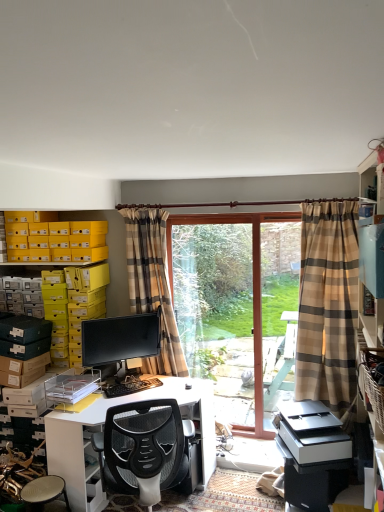
Question: Should I look upward or downward to see plaid fabric curtain at center, acting as the 1th curtain starting from the back?

Choices:
 (A) down
 (B) up

Answer: (A)

Question: Is yellow cardboard box at upper left at the left side of plaid fabric curtain at center, which is counted as the second curtain, starting from the right?

Choices:
 (A) no
 (B) yes

Answer: (B)

Question: Considering the relative sizes of yellow cardboard box at upper left and plaid fabric curtain at center, which is counted as the second curtain, starting from the right, in the image provided, is yellow cardboard box at upper left shorter than plaid fabric curtain at center, which is counted as the second curtain, starting from the right,?

Choices:
 (A) no
 (B) yes

Answer: (B)

Question: Could plaid fabric curtain at center, which is counted as the second curtain, starting from the right, be considered to be inside yellow cardboard box at upper left?

Choices:
 (A) yes
 (B) no

Answer: (B)

Question: Is yellow cardboard box at upper left taller than plaid fabric curtain at center, acting as the 1th curtain starting from the back?

Choices:
 (A) no
 (B) yes

Answer: (A)

Question: Is yellow cardboard box at upper left far from plaid fabric curtain at center, which is counted as the second curtain, starting from the right?

Choices:
 (A) no
 (B) yes

Answer: (A)

Question: Are yellow cardboard box at upper left and plaid fabric curtain at center, which ranks as the 2th curtain in front-to-back order, making contact?

Choices:
 (A) no
 (B) yes

Answer: (A)

Question: Considering the relative sizes of plaid fabric curtain at center, which is the first curtain in left-to-right order, and plaid fabric curtain at right, the 2th curtain when ordered from back to front, in the image provided, is plaid fabric curtain at center, which is the first curtain in left-to-right order, taller than plaid fabric curtain at right, the 2th curtain when ordered from back to front,?

Choices:
 (A) yes
 (B) no

Answer: (B)

Question: Are plaid fabric curtain at center, acting as the 1th curtain starting from the back, and plaid fabric curtain at right, the 2th curtain when ordered from back to front, located far from each other?

Choices:
 (A) yes
 (B) no

Answer: (A)

Question: Is plaid fabric curtain at center, acting as the 1th curtain starting from the back, outside plaid fabric curtain at right, placed as the 1th curtain when sorted from front to back?

Choices:
 (A) yes
 (B) no

Answer: (A)

Question: Considering the relative positions of plaid fabric curtain at center, which is the first curtain in left-to-right order, and plaid fabric curtain at right, acting as the first curtain starting from the right, in the image provided, is plaid fabric curtain at center, which is the first curtain in left-to-right order, in front of plaid fabric curtain at right, acting as the first curtain starting from the right,?

Choices:
 (A) no
 (B) yes

Answer: (A)

Question: Can you confirm if plaid fabric curtain at center, which is the first curtain in left-to-right order, is thinner than plaid fabric curtain at right, acting as the first curtain starting from the right?

Choices:
 (A) no
 (B) yes

Answer: (B)

Question: Can you confirm if plaid fabric curtain at center, acting as the 1th curtain starting from the back, is positioned to the right of plaid fabric curtain at right, which is the 2th curtain in left-to-right order?

Choices:
 (A) yes
 (B) no

Answer: (B)

Question: Is the position of matte black monitor at center more distant than that of plaid fabric curtain at right, the 2th curtain when ordered from back to front?

Choices:
 (A) no
 (B) yes

Answer: (B)